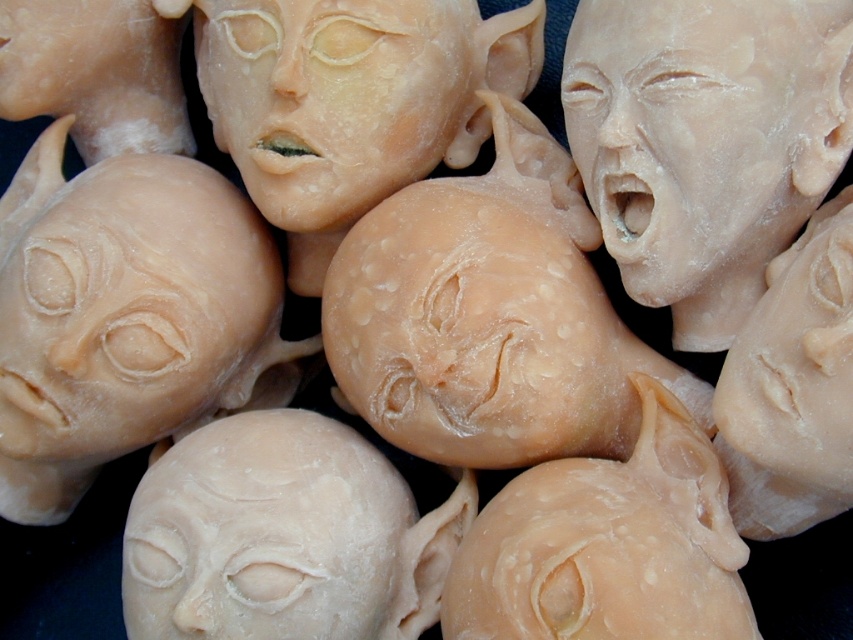
You are an artist standing in front of the sculpted heads. You need to place a spotlight exactly at the center of the matte beige head at center. What are the coordinates where you should position the spotlight?

The coordinates for the matte beige head at center are at point [283,536], so you should position the spotlight there.

You are an art curator examining the arrangement of sculpted heads in the image. You notice two points marked as point (271, 468) and point (273, 141). Based on their positions, which point is closer to the viewer?

Point (271, 468) is in front of point (273, 141), so it is closer to the viewer.